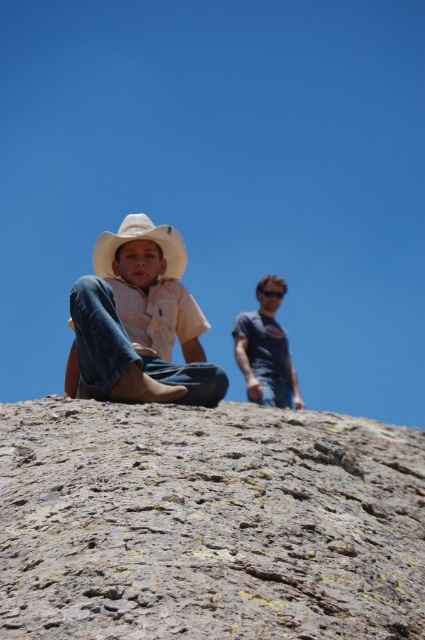
Question: Based on their relative distances, which object is farther from the white matte cowboy hat at center?

Choices:
 (A) matte white cowboy hat at center
 (B) rusty stone rock at center

Answer: (A)

Question: Observing the image, what is the correct spatial positioning of rusty stone rock at center in reference to white matte cowboy hat at center?

Choices:
 (A) right
 (B) left

Answer: (A)

Question: Which point appears farthest from the camera in this image?

Choices:
 (A) (158, 323)
 (B) (181, 262)

Answer: (B)

Question: Considering the relative positions of matte white cowboy hat at center and white matte cowboy hat at center in the image provided, where is matte white cowboy hat at center located with respect to white matte cowboy hat at center?

Choices:
 (A) below
 (B) above

Answer: (A)

Question: Does rusty stone rock at center have a greater width compared to white matte cowboy hat at center?

Choices:
 (A) no
 (B) yes

Answer: (A)

Question: Which object is positioned farthest from the matte white cowboy hat at center?

Choices:
 (A) rusty stone rock at center
 (B) white matte cowboy hat at center

Answer: (B)